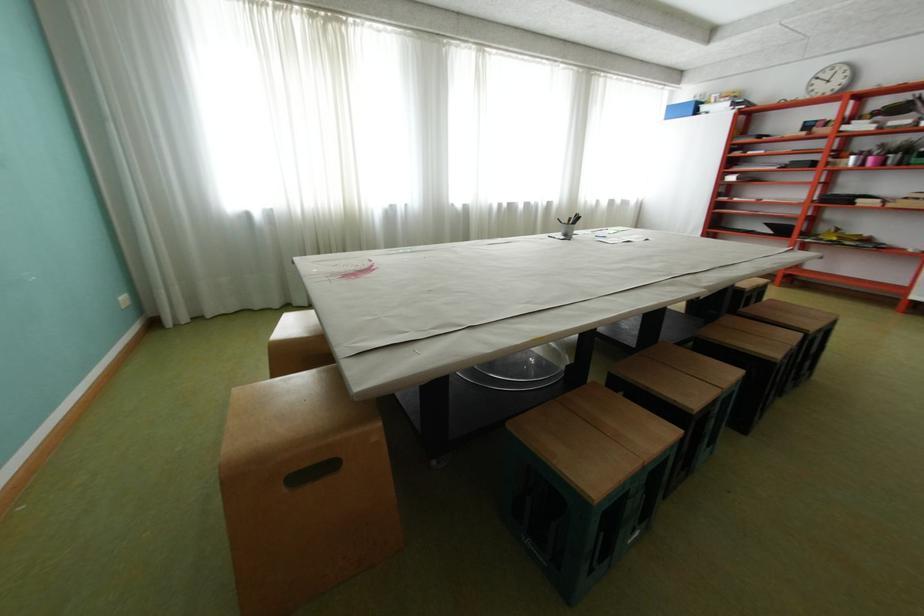
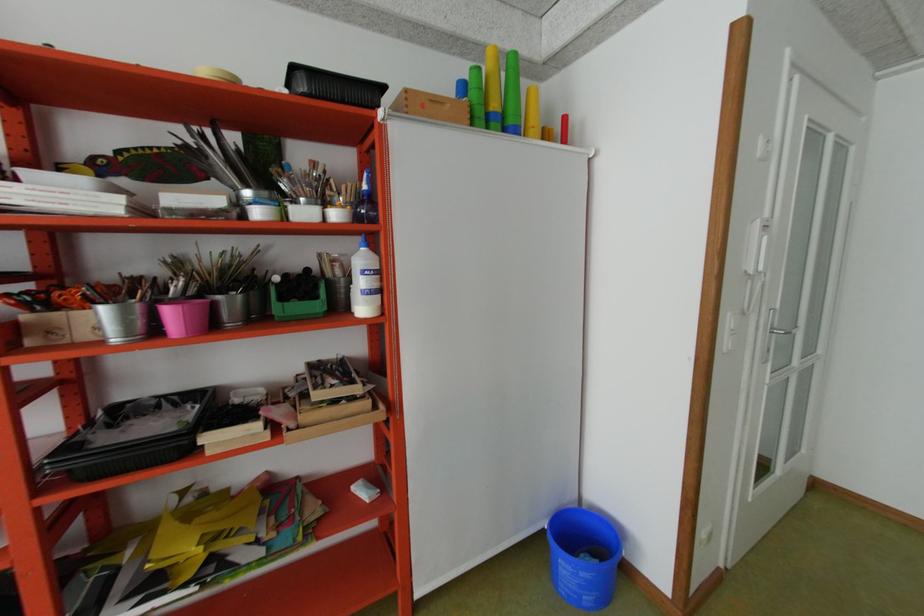
Where in the second image is the point corresponding to point (881, 159) from the first image?

(179, 313)